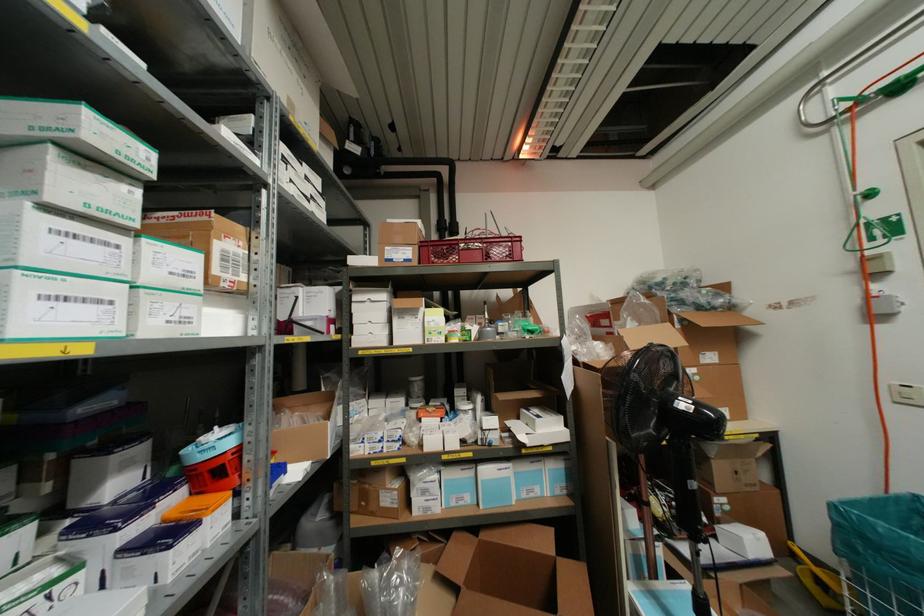
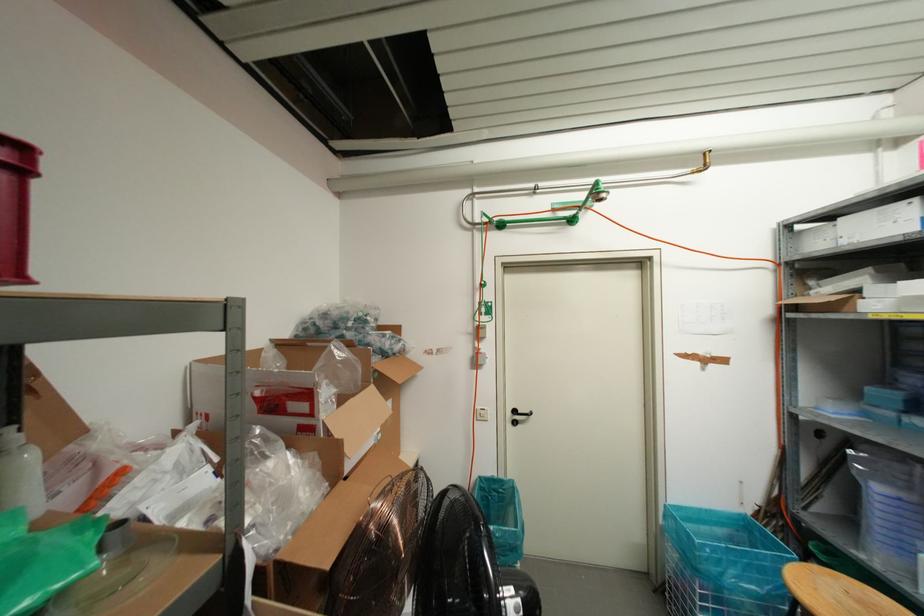
Question: The images are taken continuously from a first-person perspective. In which direction is your viewpoint rotating?

Choices:
 (A) Left
 (B) Right
 (C) Up
 (D) Down

Answer: (B)